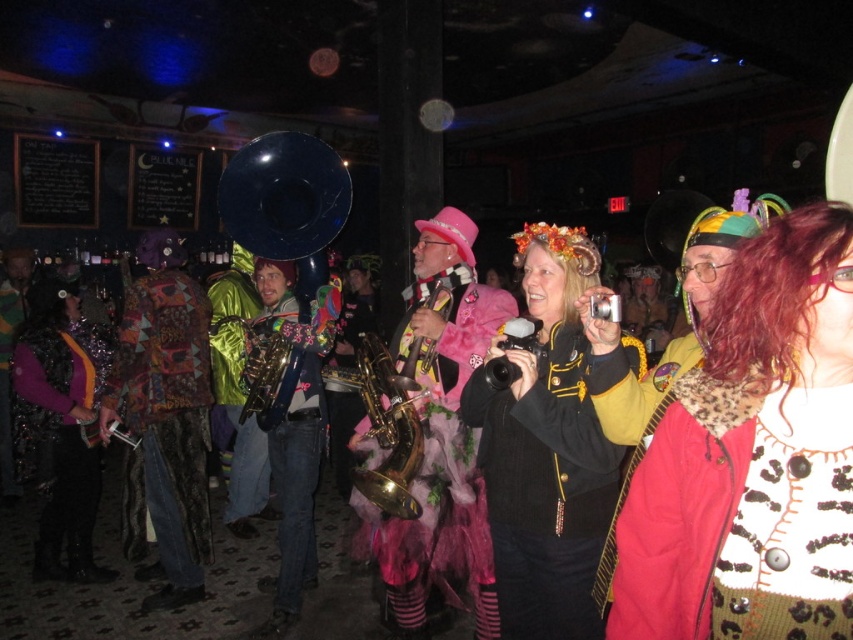
You are a photographer standing at the edge of the stage, holding a camera. You want to take a photo of the leopard print jacket at center. Is the camera close enough to capture the jacket in detail without moving closer?

The leopard print jacket at center and camera are 3.98 feet apart. Since 3.98 feet is approximately 4 feet, which is a reasonable distance for a photographer to capture details without moving closer, the camera is close enough.

You are standing at the entrance of the bar and want to find the leopard print jacket at center. Based on the coordinates given, in which direction should you look to locate it?

Result: The leopard print jacket at center is located at coordinates point (753,456), so you should look towards the lower right direction from your current position at the entrance.

You are a stage manager preparing for a performance. You have a multicolored woven fabric at center and a gold brass saxophone at center. The stage is 5 feet wide. Can both items fit side by side on the stage without overlapping?

The multicolored woven fabric at center is 4.14 feet from the gold brass saxophone at center, so yes, both items can fit side by side on the 5 feet wide stage since the distance between them is less than the stage width.